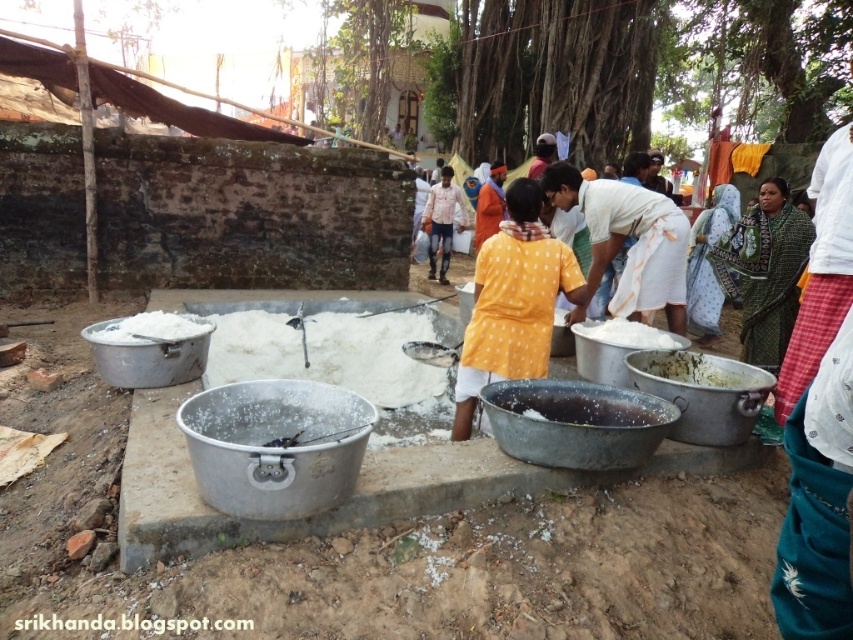
Between blue printed saree at center and white powdery substance at center, which one is positioned higher?

blue printed saree at center is higher up.

Is point (730, 208) farther from viewer compared to point (602, 336)?

Yes.

Locate an element on the screen. blue printed saree at center is located at coordinates (708, 262).

What do you see at coordinates (514, 301) in the screenshot? Image resolution: width=853 pixels, height=640 pixels. I see `yellow dotted shirt at center` at bounding box center [514, 301].

Who is positioned more to the right, yellow dotted shirt at center or white matte food at center?

From the viewer's perspective, white matte food at center appears more on the right side.

Find the location of a particular element. Image resolution: width=853 pixels, height=640 pixels. yellow dotted shirt at center is located at coordinates (514, 301).

Who is shorter, white matte food at center or white powdery substance at center?

white powdery substance at center

Who is more forward, (666,353) or (635,332)?

Point (666,353) is more forward.

Is point (686, 371) positioned before point (637, 326)?

Yes, point (686, 371) is in front of point (637, 326).

You are a GUI agent. You are given a task and a screenshot of the screen. Output one action in this format:
    pyautogui.click(x=<x>, y=<y>)
    Task: Click on the white matte food at center
    The height and width of the screenshot is (640, 853).
    Given the screenshot: What is the action you would take?
    pyautogui.click(x=699, y=369)